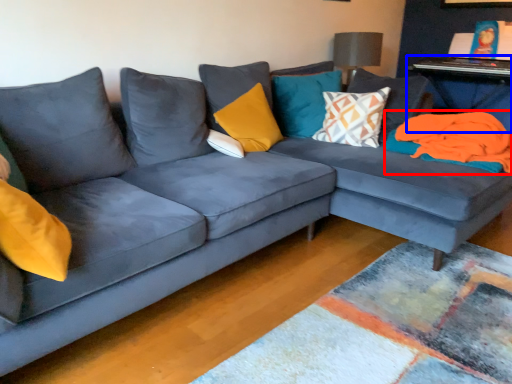
Question: Which point is closer to the camera, material (highlighted by a red box) or table (highlighted by a blue box)?

Choices:
 (A) material
 (B) table

Answer: (A)